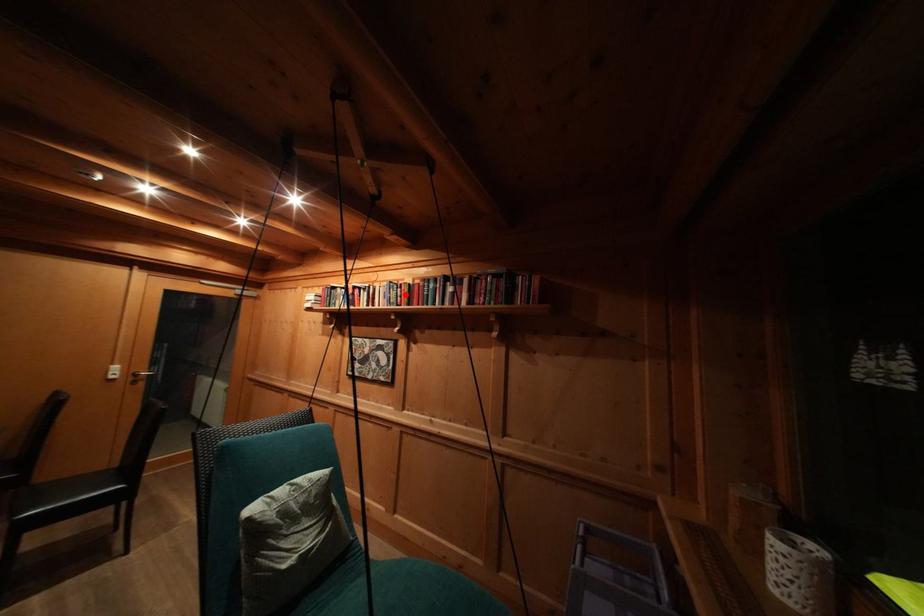
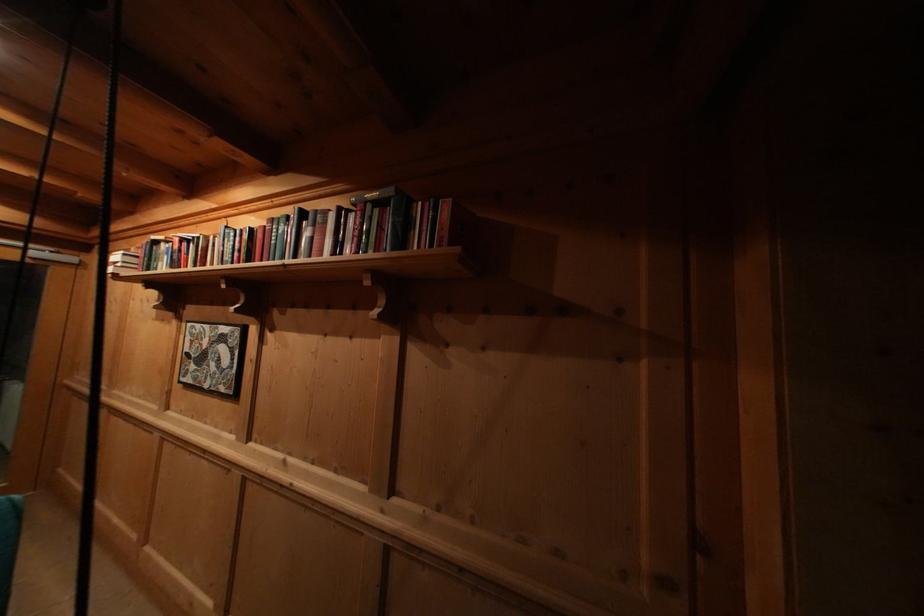
Where in the second image is the point corresponding to the highlighted location from the first image?

(244, 245)